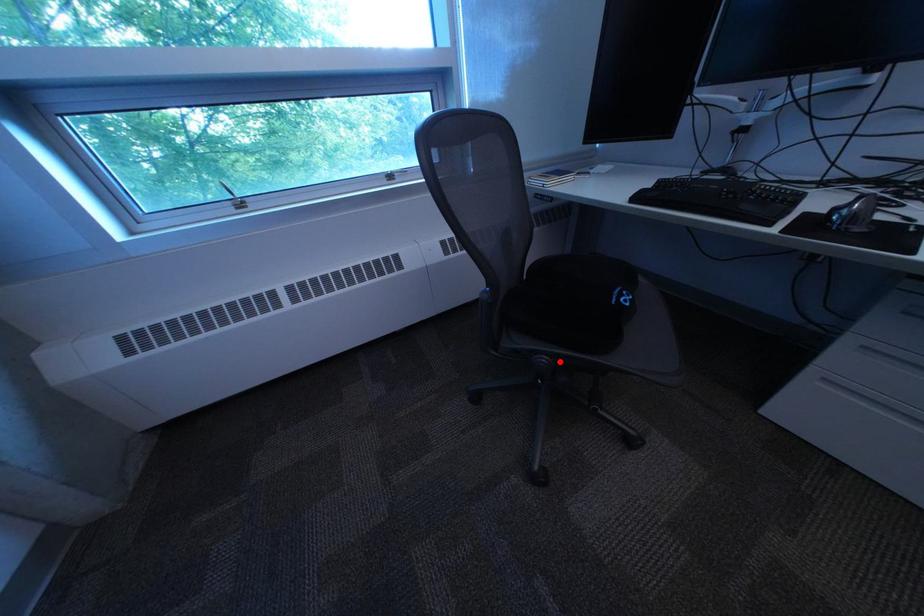
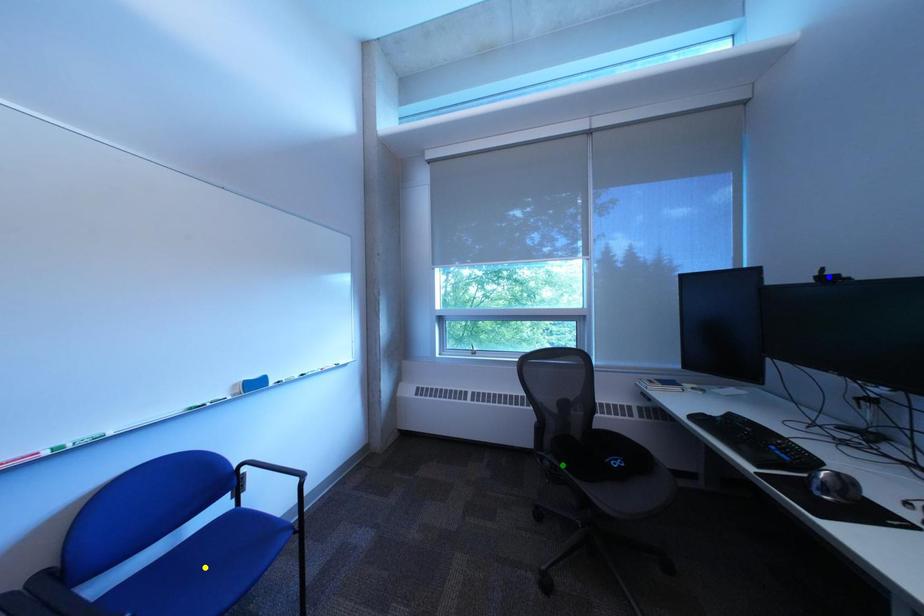
Question: I am providing you with two images of the same scene from different viewpoints. A red point is marked on the first image. You are given multiple points on the second image. Can you choose the point in image 2 that corresponds to the point in image 1?

Choices:
 (A) green point
 (B) yellow point
 (C) blue point

Answer: (A)